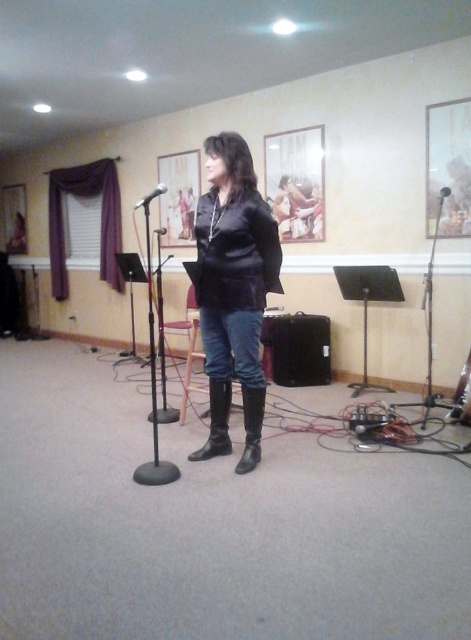
Question: Can you confirm if matte black jacket at center is positioned below black leather speaker at center?

Choices:
 (A) yes
 (B) no

Answer: (B)

Question: Which point is farther from the camera taking this photo?

Choices:
 (A) (228, 451)
 (B) (284, 237)

Answer: (B)

Question: Is wooden picture frame at left bigger than black matte microphone at center?

Choices:
 (A) no
 (B) yes

Answer: (B)

Question: Can you confirm if leather boots at center is positioned to the right of wooden picture frame at left?

Choices:
 (A) yes
 (B) no

Answer: (A)

Question: Among these objects, which one is farthest from the camera?

Choices:
 (A) black leather speaker at center
 (B) metallic silver microphone at center

Answer: (A)

Question: Among these objects, which one is farthest from the camera?

Choices:
 (A) black leather speaker at center
 (B) black matte microphone at center

Answer: (B)